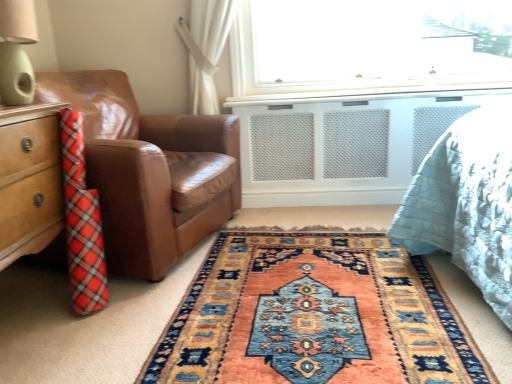
Question: From the image's perspective, is brown leather chair at left located above or below matte green lampshade at upper left?

Choices:
 (A) above
 (B) below

Answer: (B)

Question: Does point (173, 173) appear closer or farther from the camera than point (25, 4)?

Choices:
 (A) closer
 (B) farther

Answer: (B)

Question: Which object is the farthest from the carpet with intricate patterns at center?

Choices:
 (A) matte green lampshade at upper left
 (B) brown leather chair at left

Answer: (A)

Question: Which object is the farthest from the carpet with intricate patterns at center?

Choices:
 (A) matte green lampshade at upper left
 (B) brown leather chair at left

Answer: (A)